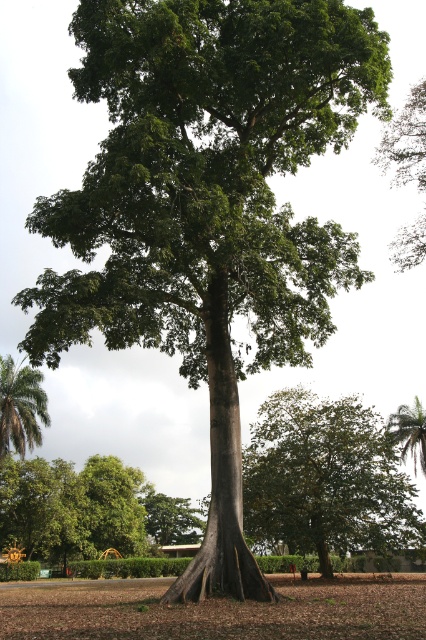
You are planning to install a new bench in the park. The bench requires a minimum of 3 meters of clearance from the base of any tree to prevent root damage. You see the green leafy tree at upper right and the green leafy palm tree at lower left. Which tree requires the bench to be placed farther away from its base to comply with the clearance rule?

The green leafy tree at upper right has a greater height compared to the green leafy palm tree at lower left. Since taller trees typically have larger root systems, the bench should be placed farther away from the green leafy tree at upper right to comply with the 3 meters clearance rule.

You are a bird looking for a place to perch. You see the green leafy tree at upper right and the green leafy palm tree at lower left. Which tree is located above the other?

The green leafy tree at upper right is positioned over the green leafy palm tree at lower left.

You are planning to plant a new tree in your backyard and want to know which tree has a wider canopy. Based on the image, which one is wider between the green leafy tree at upper right and the green leafy palm tree at lower left?

The green leafy tree at upper right has a wider canopy than the green leafy palm tree at lower left.